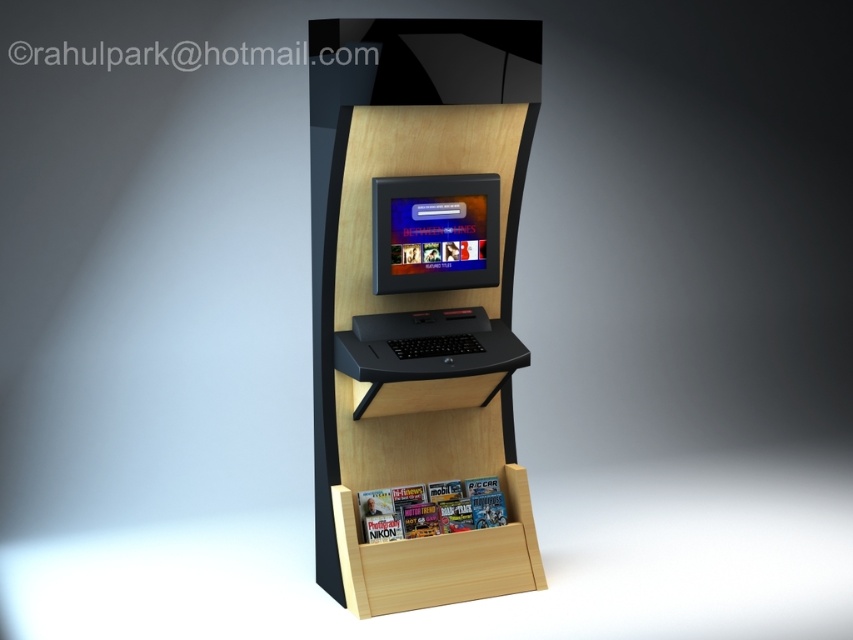
Question: Which point is farther to the camera?

Choices:
 (A) black matte laptop at center
 (B) light wood/bookshelf at center
 (C) matte black laptop at center

Answer: (C)

Question: Is matte black laptop at center thinner than black matte laptop at center?

Choices:
 (A) yes
 (B) no

Answer: (A)

Question: Does light wood/bookshelf at center come in front of black matte laptop at center?

Choices:
 (A) no
 (B) yes

Answer: (B)

Question: Is light wood/bookshelf at center below black matte laptop at center?

Choices:
 (A) yes
 (B) no

Answer: (A)

Question: Which point appears closest to the camera in this image?

Choices:
 (A) tap(370, 593)
 (B) tap(448, 288)

Answer: (A)

Question: Among these objects, which one is farthest from the camera?

Choices:
 (A) light wood/bookshelf at center
 (B) black matte laptop at center
 (C) matte black laptop at center

Answer: (C)